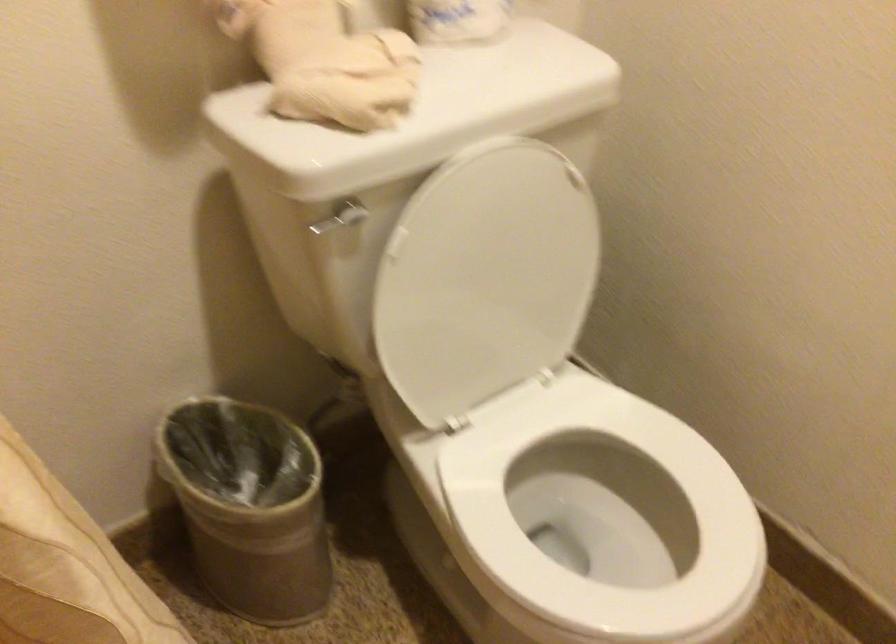
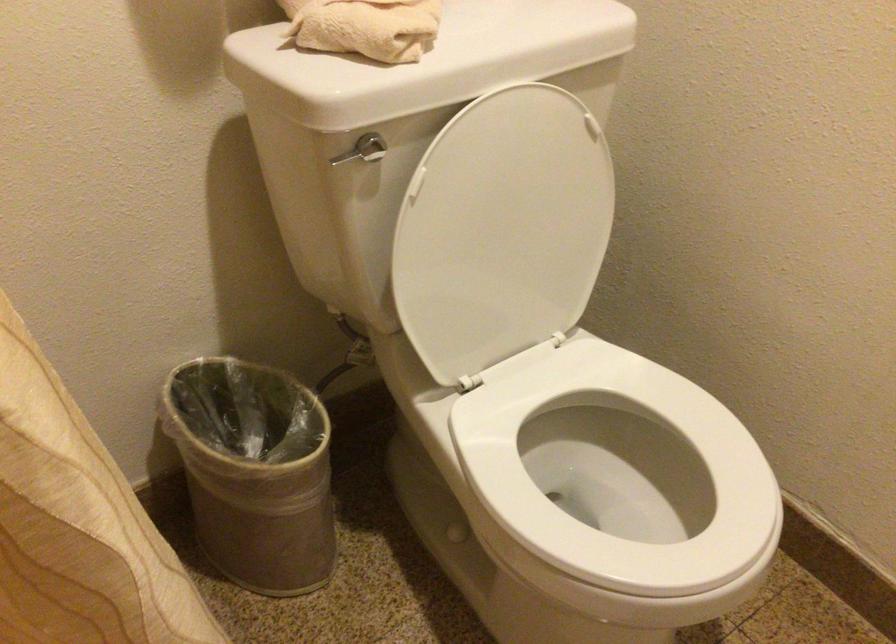
In the second image, find the point that corresponds to (487,279) in the first image.

(502, 230)